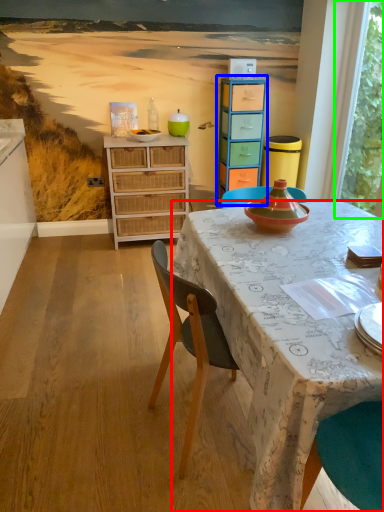
Question: Which object is the farthest from desk (highlighted by a red box)? Choose among these: cabinetry (highlighted by a blue box) or window screen (highlighted by a green box).

Choices:
 (A) cabinetry
 (B) window screen

Answer: (B)